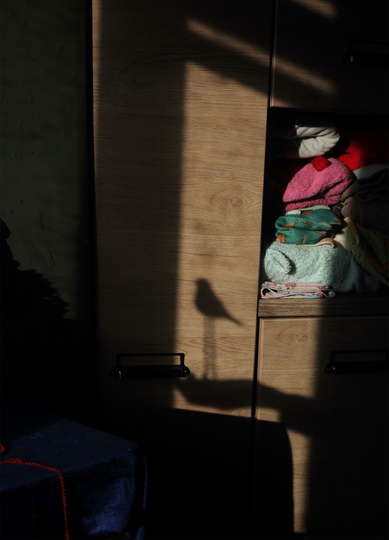
The image size is (389, 540). In order to click on front of dresser in this screenshot , I will do `click(326, 338)`.